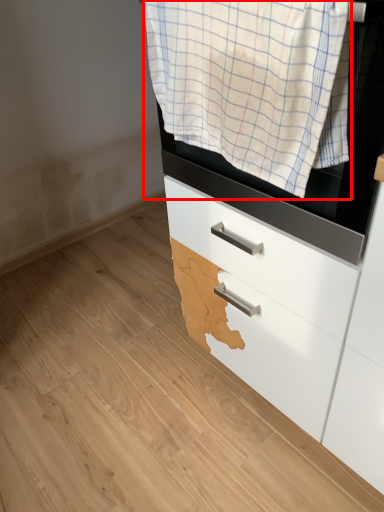
Question: From the image's perspective, what is the correct spatial relationship of clothing (annotated by the red box) in relation to chest of drawers?

Choices:
 (A) below
 (B) above

Answer: (B)